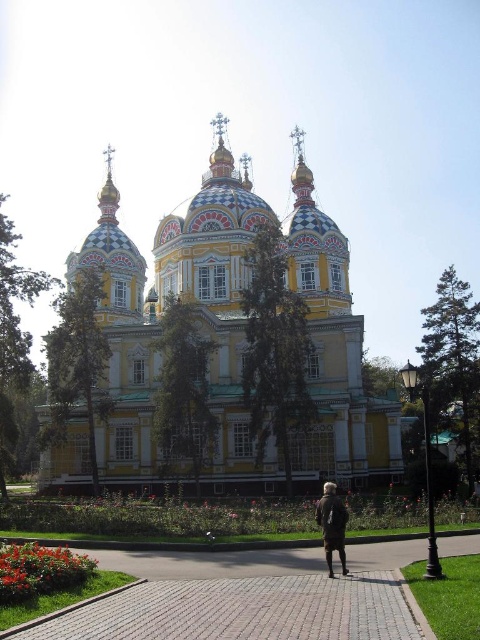
You are an artist planning to paint a scene that includes both the painted wood church at center and the dark brown fur coat at center. Based on their sizes in the image, which object should you depict as more prominent in your artwork?

The painted wood church at center has a larger size compared to the dark brown fur coat at center, so it should be depicted as more prominent in the artwork.

You are standing at the entrance of the cathedral and see the brick paved walkway at lower center and the dark brown fur coat at center. Which object is nearer to you?

The brick paved walkway at lower center is closer to the viewer than the dark brown fur coat at center.

You are a tourist standing in front of the painted wood church at center and the brick paved walkway at lower center. Which object is wider?

The painted wood church at center is wider than the brick paved walkway at lower center.